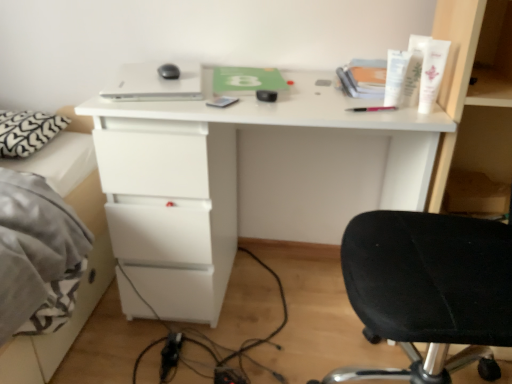
Question: Should I look upward or downward to see matte gray notepad at center?

Choices:
 (A) up
 (B) down

Answer: (A)

Question: Is white matte desk at center surrounding white heart-patterned pillow at left?

Choices:
 (A) yes
 (B) no

Answer: (B)

Question: Does white matte desk at center have a greater width compared to white heart-patterned pillow at left?

Choices:
 (A) no
 (B) yes

Answer: (B)

Question: Is white matte desk at center at the right side of white heart-patterned pillow at left?

Choices:
 (A) no
 (B) yes

Answer: (B)

Question: From the image's perspective, is white matte desk at center on top of white heart-patterned pillow at left?

Choices:
 (A) yes
 (B) no

Answer: (B)

Question: Is white matte desk at center in front of white heart-patterned pillow at left?

Choices:
 (A) yes
 (B) no

Answer: (A)

Question: Is white matte desk at center smaller than white heart-patterned pillow at left?

Choices:
 (A) yes
 (B) no

Answer: (B)

Question: Is white cream tube at upper right, which is counted as the first toiletry, starting from the left, shorter than white plastic tube at upper right, the 3th toiletry when ordered from left to right?

Choices:
 (A) yes
 (B) no

Answer: (A)

Question: Is white cream tube at upper right, the 3th toiletry positioned from the right, taller than white plastic tube at upper right, which is counted as the 1th toiletry, starting from the right?

Choices:
 (A) no
 (B) yes

Answer: (A)

Question: From a real-world perspective, is white cream tube at upper right, the 3th toiletry positioned from the right, positioned over white plastic tube at upper right, which is counted as the 1th toiletry, starting from the right, based on gravity?

Choices:
 (A) no
 (B) yes

Answer: (A)

Question: Can you confirm if white cream tube at upper right, the 3th toiletry positioned from the right, is positioned to the left of white plastic tube at upper right, the 3th toiletry when ordered from left to right?

Choices:
 (A) no
 (B) yes

Answer: (B)

Question: From the image's perspective, is white cream tube at upper right, which is counted as the first toiletry, starting from the left, beneath white plastic tube at upper right, the 3th toiletry when ordered from left to right?

Choices:
 (A) yes
 (B) no

Answer: (B)

Question: Is white cream tube at upper right, which is counted as the first toiletry, starting from the left, bigger than white plastic tube at upper right, which is counted as the 1th toiletry, starting from the right?

Choices:
 (A) yes
 (B) no

Answer: (B)

Question: Does white heart-patterned pillow at left appear on the right side of white matte desk at center?

Choices:
 (A) no
 (B) yes

Answer: (A)